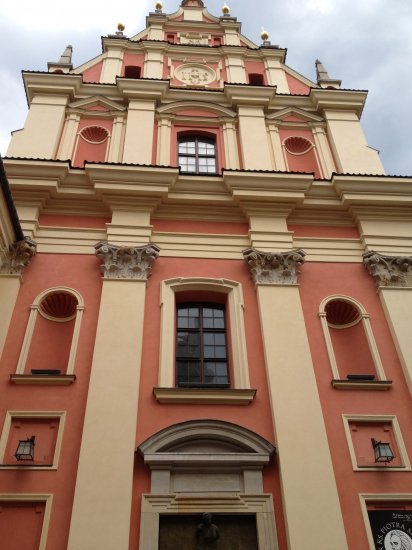
Identify the location of lantern. (382, 451), (24, 450).